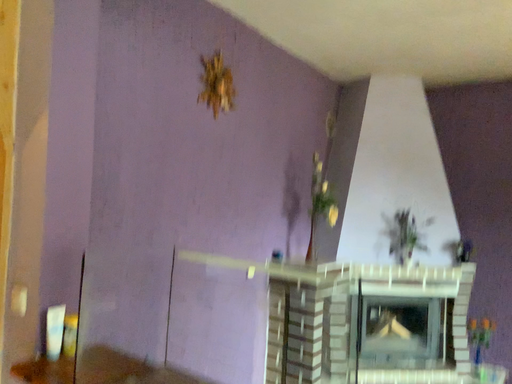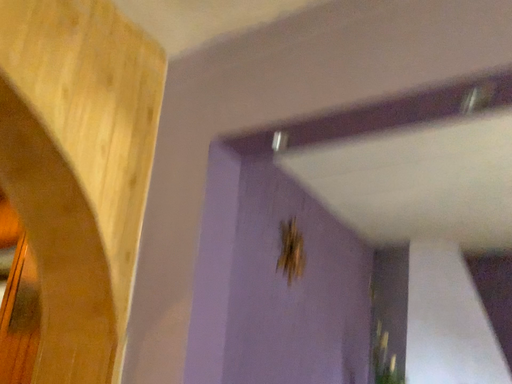
Question: How did the camera likely rotate when shooting the video?

Choices:
 (A) rotated downward
 (B) rotated upward

Answer: (B)